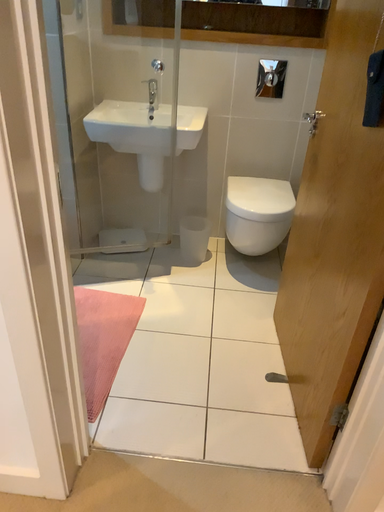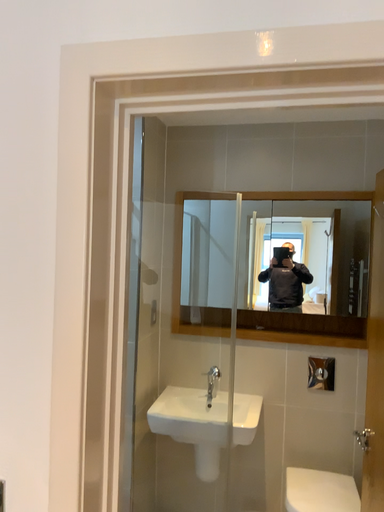
Question: Which way did the camera rotate in the video?

Choices:
 (A) rotated upward
 (B) rotated downward

Answer: (A)